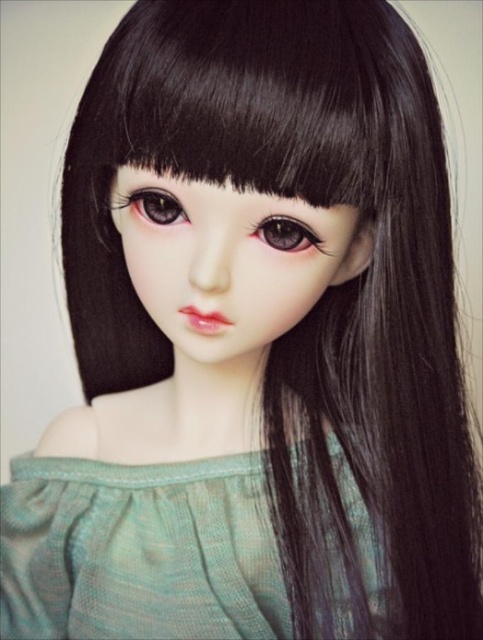
Question: Where is green knitted dress at center located in relation to black silky hair at upper center in the image?

Choices:
 (A) above
 (B) below

Answer: (B)

Question: Which of the following is the farthest from the observer?

Choices:
 (A) (307, 237)
 (B) (141, 525)

Answer: (B)

Question: Which point is closer to the camera taking this photo?

Choices:
 (A) (172, 577)
 (B) (278, 230)

Answer: (B)

Question: Does black silky hair at upper center appear on the right side of satin brown eye at center?

Choices:
 (A) yes
 (B) no

Answer: (B)

Question: Estimate the real-world distances between objects in this image. Which object is farther from the black silky hair at upper center?

Choices:
 (A) green knitted dress at center
 (B) satin brown eye at center

Answer: (A)

Question: Does satin brown eye at center have a greater width compared to brown glossy eye at center?

Choices:
 (A) no
 (B) yes

Answer: (A)